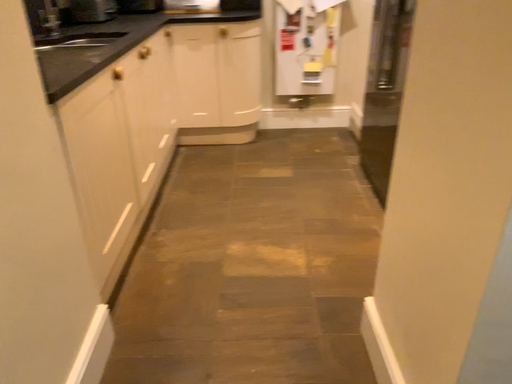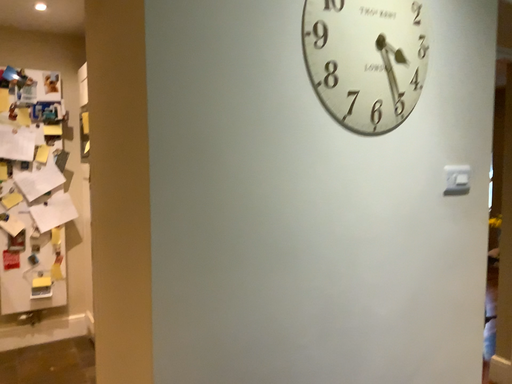
Question: Which way did the camera rotate in the video?

Choices:
 (A) rotated right
 (B) rotated left

Answer: (A)